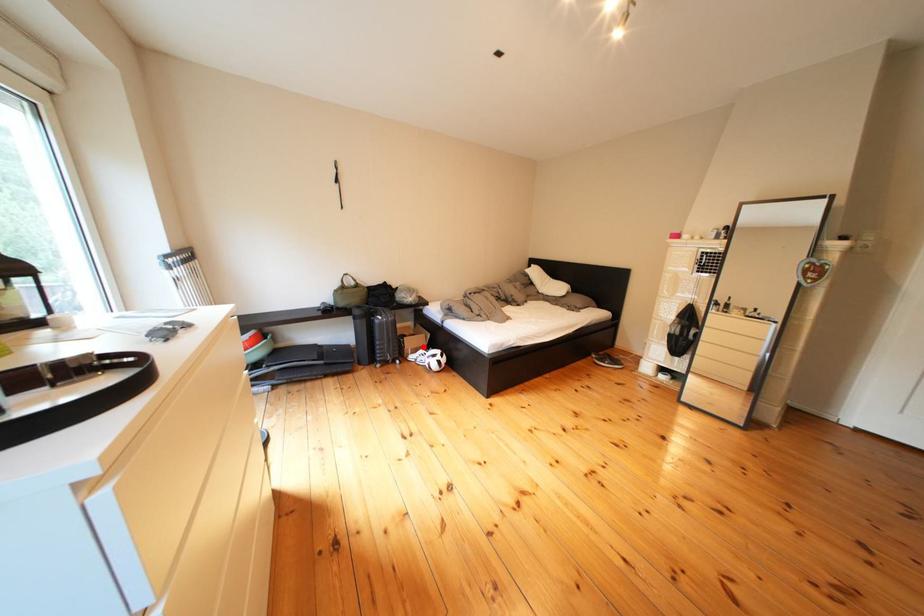
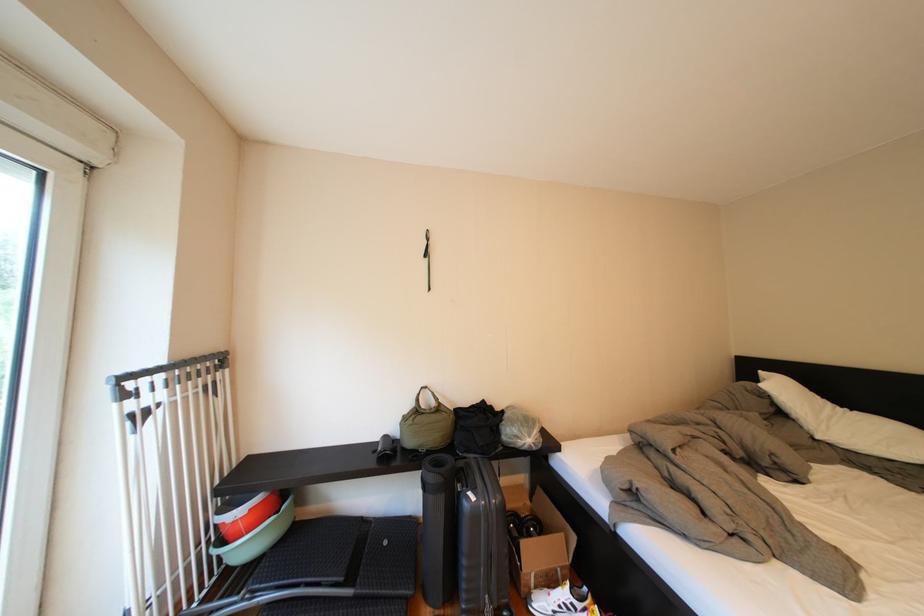
Find the pixel in the second image that matches the highlighted location in the first image.

(544, 557)